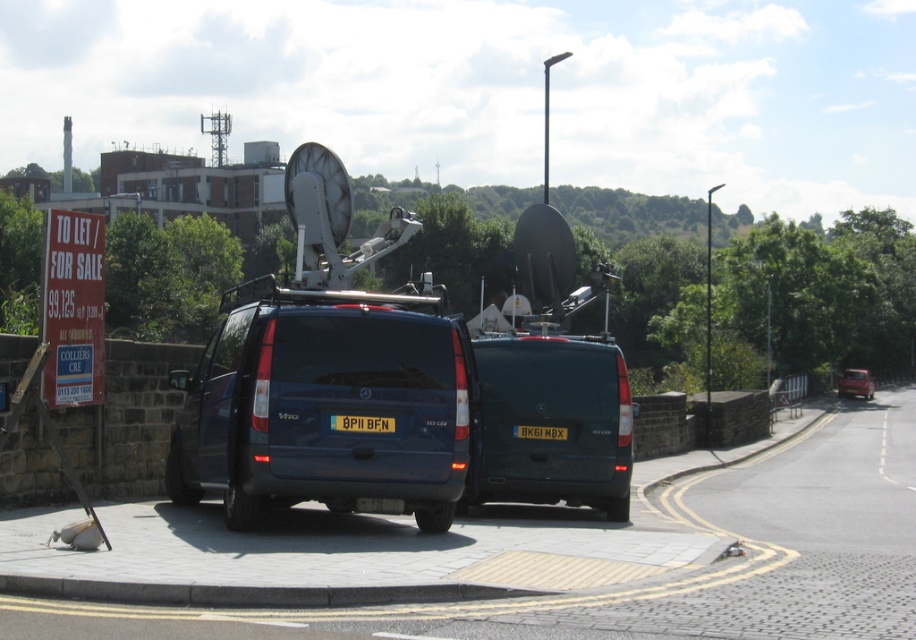
You are a delivery driver who needs to park your truck behind the matte black van at center. The yellow matte license plate at rear is blocking the entrance to the parking lot. Can you drive around the van without hitting the license plate?

The matte black van at center is larger than the yellow matte license plate at rear, so you can drive around the van on either side, ensuring you avoid the yellow matte license plate at rear which is positioned at the back of the van.

You are a delivery driver who needs to park your truck between the yellow matte license plate at rear and the metallic red car at right. The truck requires 70 meters of space to park. Can you safely park there?

The distance between the yellow matte license plate at rear and the metallic red car at right is 67.94 meters, which is less than the required 70 meters. Therefore, you cannot safely park your truck there.

You are standing at a point 73.42 meters away from a specific point marked as point (870, 380) in the image. You see two dark colored vans parked side by side near a road with satellite dishes on their roofs. There is also a red signboard to the left of the vans. Can you confirm if the specific point 0.591, 0.951 is closer to the vans or the red signboard?

The distance of point (870, 380) from viewer is 73.42 meters. Since the point is exactly at that distance, it is neither closer to the vans nor the red signboard but located at the same distance as the viewer.